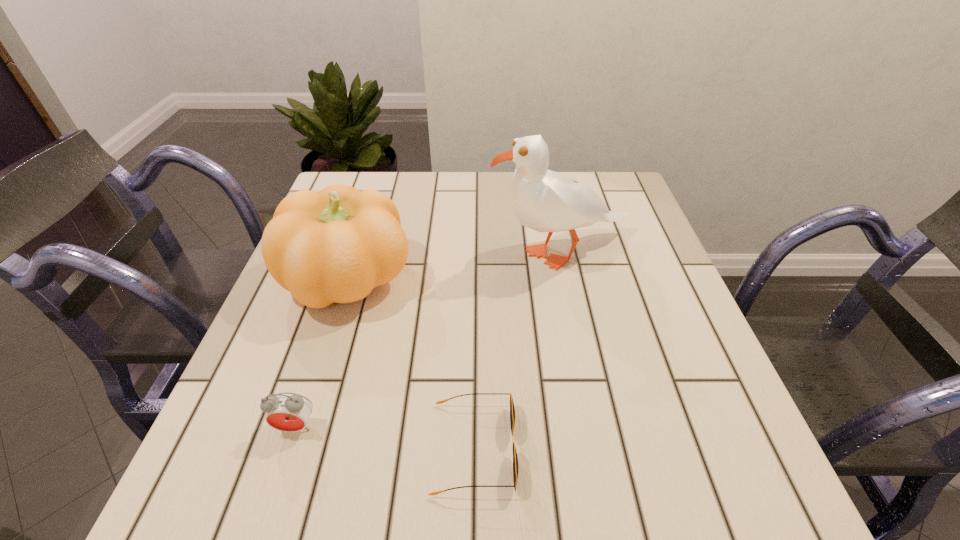
Where is `empty space between the shortest object and the third shortest object`? The height and width of the screenshot is (540, 960). empty space between the shortest object and the third shortest object is located at coordinates (412, 363).

The image size is (960, 540). I want to click on vacant area that lies between the shortest object and the third tallest object, so click(x=385, y=437).

This screenshot has height=540, width=960. I want to click on empty location between the third tallest object and the third shortest object, so click(x=324, y=352).

Image resolution: width=960 pixels, height=540 pixels. In order to click on vacant area between the alarm clock and the second tallest object in this screenshot , I will do `click(324, 352)`.

Identify the location of vacant space that's between the alarm clock and the tallest object. (428, 340).

The width and height of the screenshot is (960, 540). I want to click on empty location between the pumpkin and the sunglasses, so click(x=412, y=363).

Locate an element on the screen. The height and width of the screenshot is (540, 960). vacant point located between the pumpkin and the sunglasses is located at coordinates (412, 363).

I want to click on vacant space that is in between the pumpkin and the tallest object, so click(456, 266).

Locate an element on the screen. Image resolution: width=960 pixels, height=540 pixels. blank region between the gull and the pumpkin is located at coordinates (456, 266).

Choose which object is the nearest neighbor to the gull. Please provide its 2D coordinates. Your answer should be formatted as a tuple, i.e. [(x, y)], where the tuple contains the x and y coordinates of a point satisfying the conditions above.

[(336, 245)]